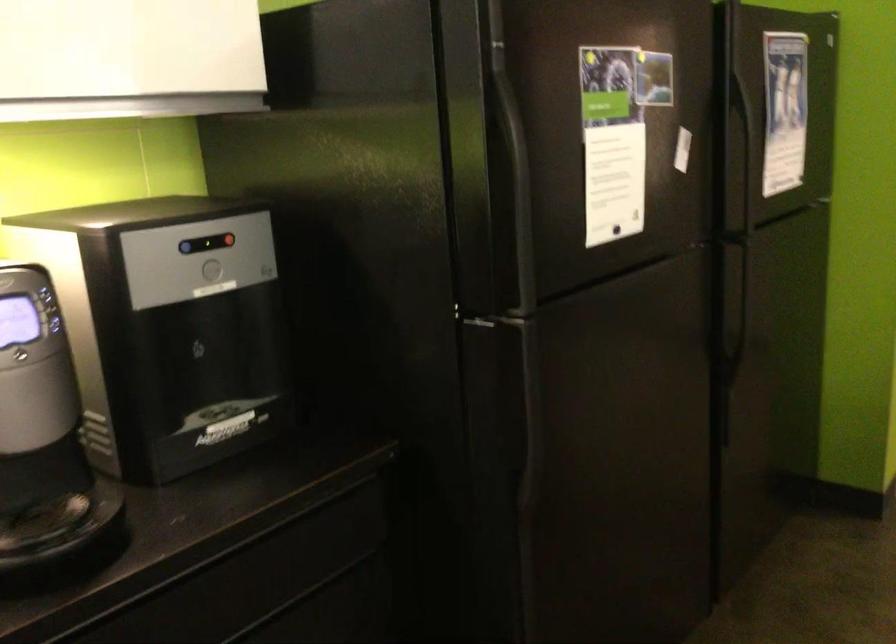
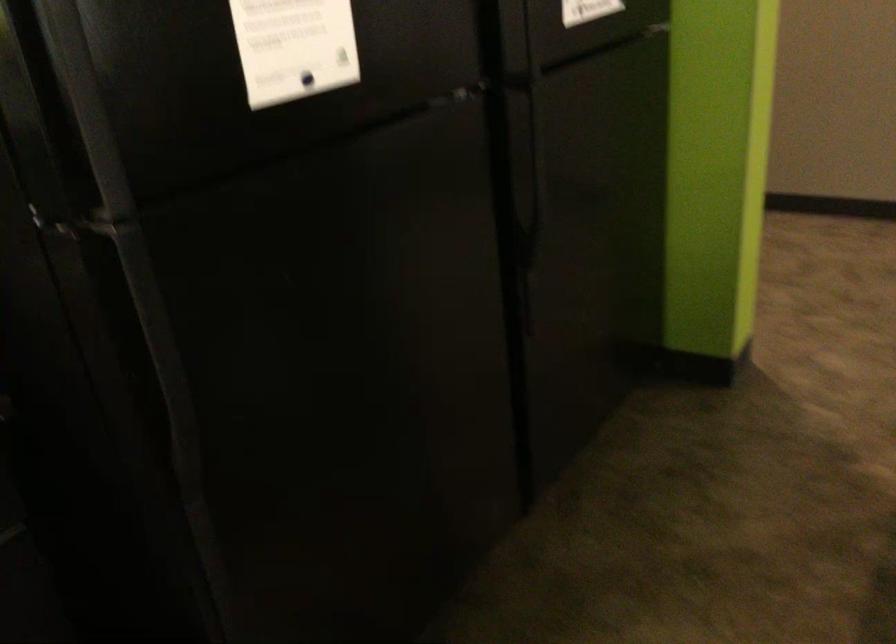
In a continuous first-person perspective shot, in which direction is the camera moving?

The cameraman walked toward right, forward.